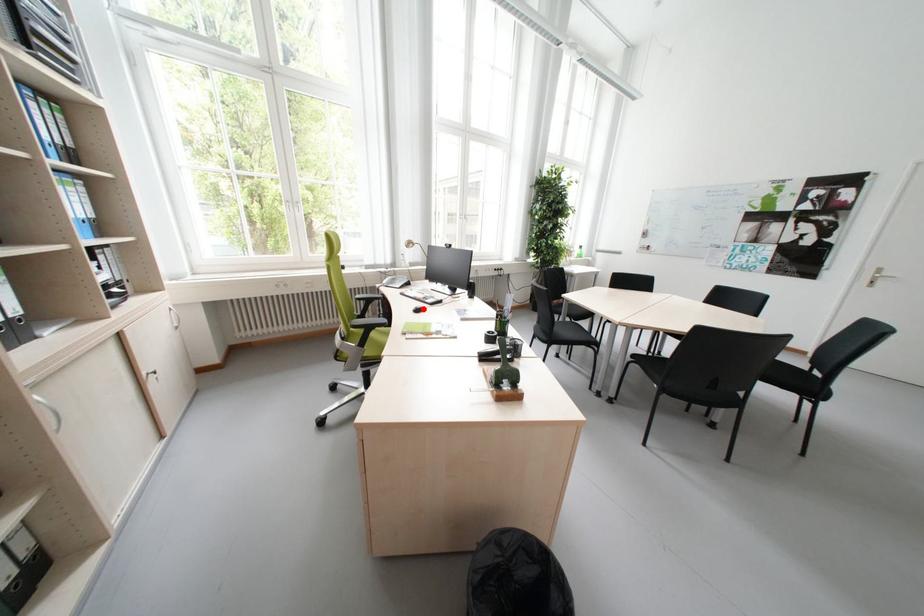
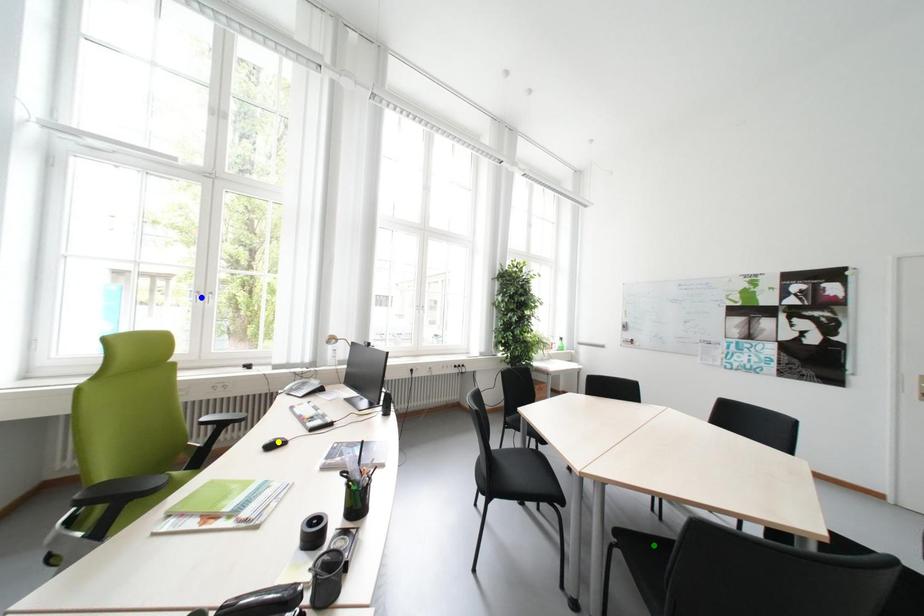
Question: I am providing you with two images of the same scene from different viewpoints. A red point is marked on the first image. You are given multiple points on the second image. Which mark in image 2 goes with the point in image 1?

Choices:
 (A) green point
 (B) blue point
 (C) yellow point

Answer: (C)